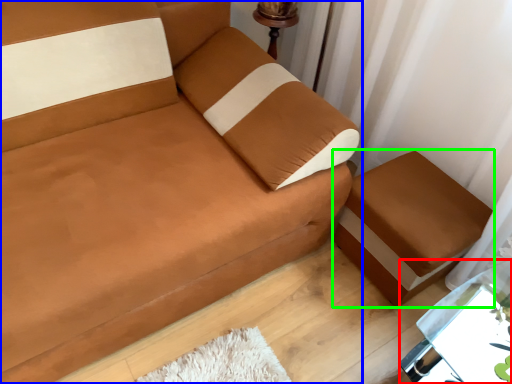
Question: Which object is the farthest from table (highlighted by a red box)? Choose among these: studio couch (highlighted by a blue box) or furniture (highlighted by a green box).

Choices:
 (A) studio couch
 (B) furniture

Answer: (A)